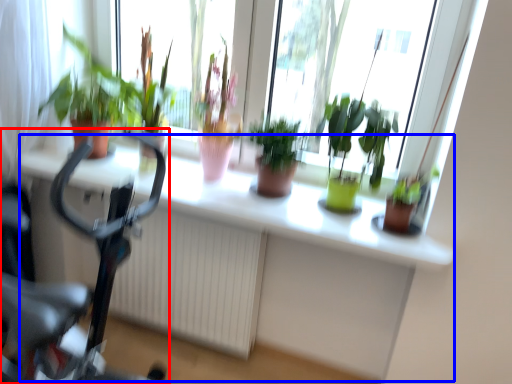
Question: Which object is closer to the camera taking this photo, bicycle (highlighted by a red box) or computer desk (highlighted by a blue box)?

Choices:
 (A) bicycle
 (B) computer desk

Answer: (B)